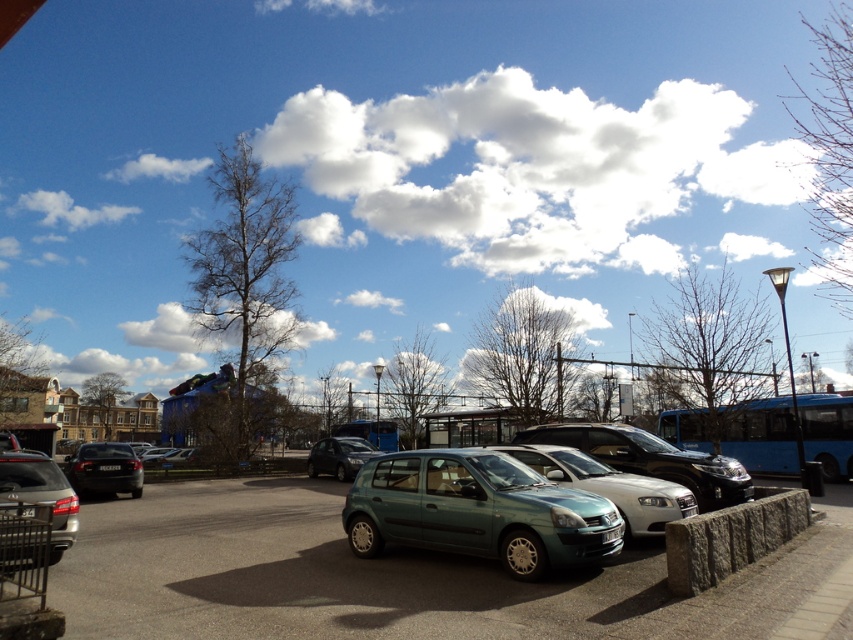
Is metallic green hatchback at center shorter than matte gray suv at lower left?

Indeed, metallic green hatchback at center has a lesser height compared to matte gray suv at lower left.

Between metallic green hatchback at center and matte gray suv at lower left, which one has less height?

metallic green hatchback at center

Locate an element on the screen. Image resolution: width=853 pixels, height=640 pixels. metallic green hatchback at center is located at coordinates (479, 512).

Between blue metallic bus at right and metallic silver hatchback at center, which one appears on the left side from the viewer's perspective?

metallic silver hatchback at center is more to the left.

Which is more to the right, blue metallic bus at right or metallic silver hatchback at center?

From the viewer's perspective, blue metallic bus at right appears more on the right side.

Is point (820, 456) positioned in front of point (697, 497)?

No, it is not.

The image size is (853, 640). In order to click on blue metallic bus at right in this screenshot , I will do `click(761, 435)`.

Does metallic teal hatchback at center lie behind matte black car at center?

No.

Is metallic teal hatchback at center below matte black car at center?

Actually, metallic teal hatchback at center is above matte black car at center.

The image size is (853, 640). Describe the element at coordinates (610, 484) in the screenshot. I see `metallic teal hatchback at center` at that location.

I want to click on metallic teal hatchback at center, so click(610, 484).